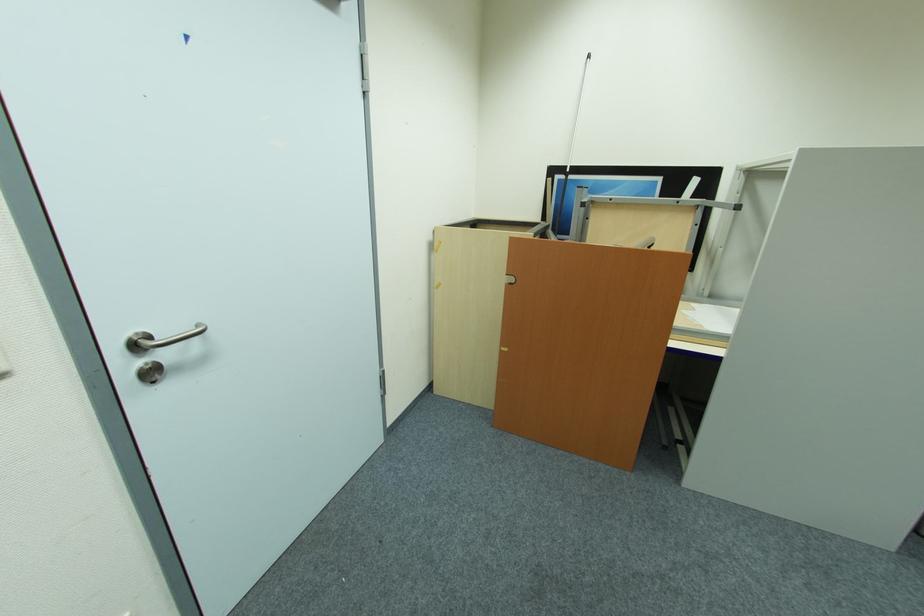
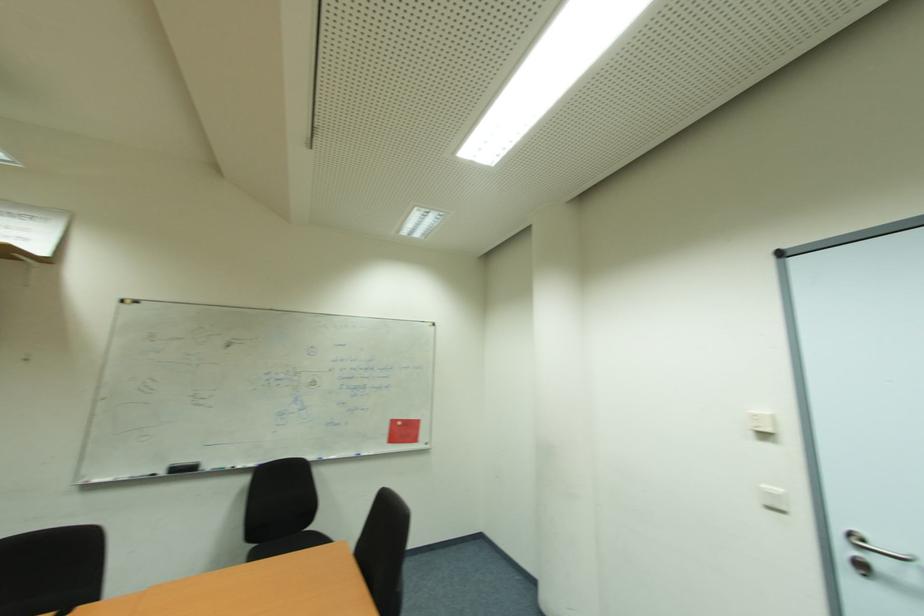
Where in the second image is the point corresponding to point (155, 374) from the first image?

(869, 570)